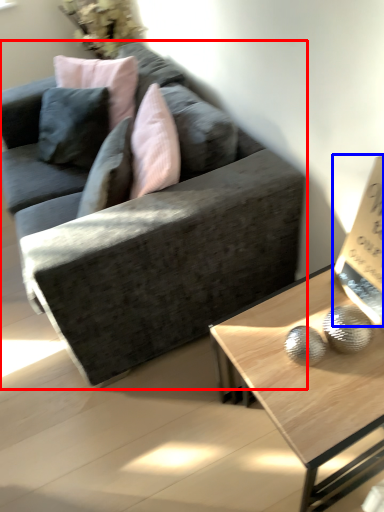
Question: Which object is closer to the camera taking this photo, studio couch (highlighted by a red box) or paperback book (highlighted by a blue box)?

Choices:
 (A) studio couch
 (B) paperback book

Answer: (B)